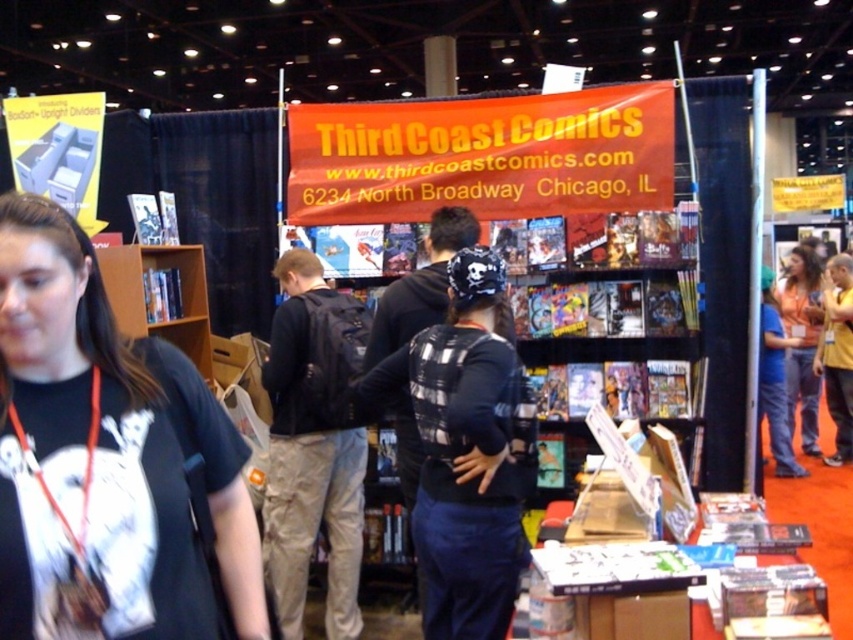
Question: Can you confirm if orange fabric at right is wider than blue denim jeans at lower right?

Choices:
 (A) yes
 (B) no

Answer: (B)

Question: Which point appears closest to the camera in this image?

Choices:
 (A) (451, 600)
 (B) (770, 324)
 (C) (189, 272)
 (D) (814, 385)

Answer: (A)

Question: Which point appears closest to the camera in this image?

Choices:
 (A) (793, 365)
 (B) (434, 564)

Answer: (B)

Question: Is orange fabric at right wider than blue denim jeans at lower right?

Choices:
 (A) no
 (B) yes

Answer: (A)

Question: Which point is closer to the camera taking this photo?

Choices:
 (A) (328, 620)
 (B) (421, 541)
 (C) (778, 372)
 (D) (41, 204)

Answer: (D)

Question: Does black t-shirt at left appear on the left side of black plaid shirt at center?

Choices:
 (A) yes
 (B) no

Answer: (A)